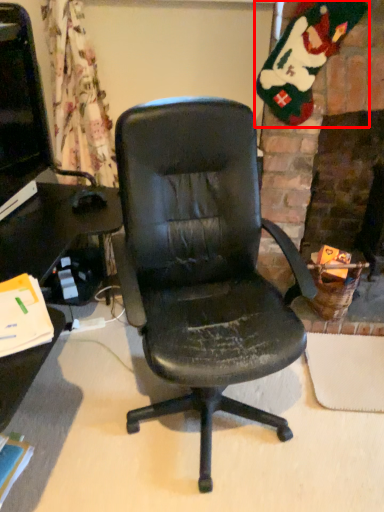
Question: Where is santa claus (annotated by the red box) located in relation to computer monitor in the image?

Choices:
 (A) right
 (B) left

Answer: (A)